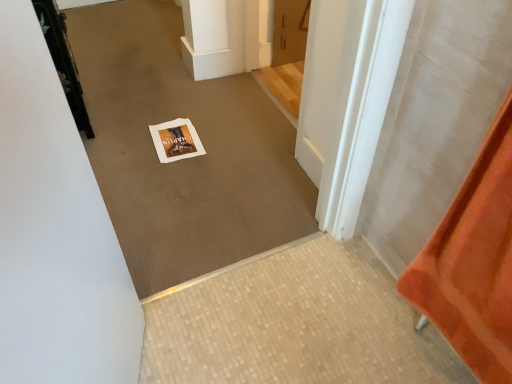
Question: Is white paper at center bigger or smaller than white paper at center?

Choices:
 (A) small
 (B) big

Answer: (B)

Question: In the image, is white paper at center on the left side or the right side of white paper at center?

Choices:
 (A) left
 (B) right

Answer: (B)

Question: Estimate the real-world distances between objects in this image. Which object is farther from the black metal door at upper left, which is the 2th door in right-to-left order?

Choices:
 (A) white paper at center
 (B) white paper at center
 (C) matte wood door at upper center, the second door viewed from the left

Answer: (C)

Question: Estimate the real-world distances between objects in this image. Which object is closer to the white paper at center?

Choices:
 (A) matte wood door at upper center, placed as the first door when sorted from right to left
 (B) black metal door at upper left, the first door in the left-to-right sequence
 (C) white paper at center

Answer: (C)